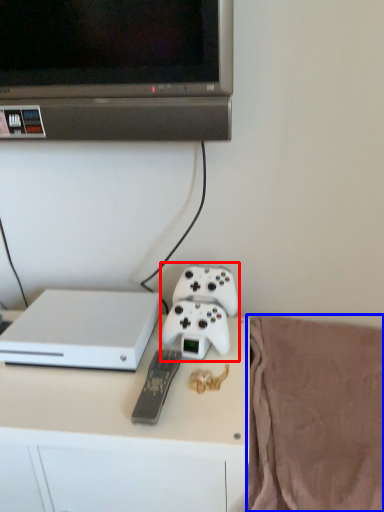
Question: Which of the following is the closest to the observer, game controller (highlighted by a red box) or blanket (highlighted by a blue box)?

Choices:
 (A) game controller
 (B) blanket

Answer: (B)